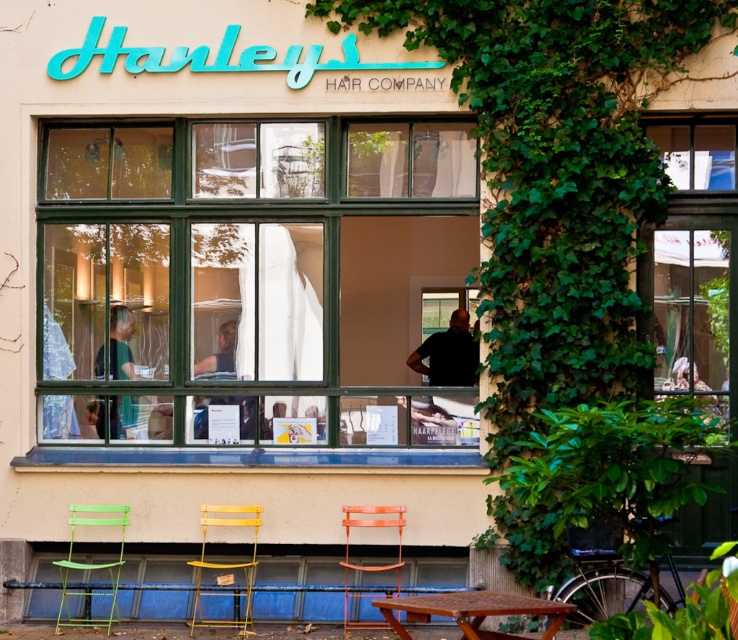
Question: Is green fabric shirt at left below orange plastic chair at center?

Choices:
 (A) no
 (B) yes

Answer: (A)

Question: Does yellow metal chair at center have a larger size compared to green metal chair at lower left?

Choices:
 (A) no
 (B) yes

Answer: (B)

Question: Among these objects, which one is nearest to the camera?

Choices:
 (A) orange plastic chair at center
 (B) green wooden window at center
 (C) rustic wooden table at lower center

Answer: (C)

Question: Considering the relative positions of black matte shirt at center and green metal chair at lower left in the image provided, where is black matte shirt at center located with respect to green metal chair at lower left?

Choices:
 (A) above
 (B) below

Answer: (A)

Question: Which point appears closest to the camera in this image?

Choices:
 (A) (134, 323)
 (B) (68, 566)

Answer: (B)

Question: Among these objects, which one is nearest to the camera?

Choices:
 (A) green metal chair at lower left
 (B) green fabric shirt at left

Answer: (A)